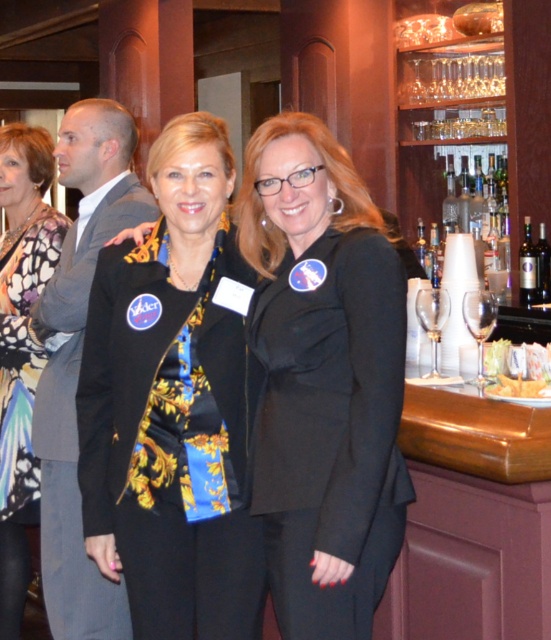
Which is behind, point (40, 419) or point (15, 272)?

The point (15, 272) is more distant.

Does point (56, 538) come behind point (17, 390)?

No.

Does point (45, 451) lie in front of point (34, 374)?

Yes, point (45, 451) is closer to viewer.

In order to click on gray suit at left in this screenshot , I will do coord(79,362).

Is black matte blazer at center below gray suit at left?

Indeed, black matte blazer at center is positioned under gray suit at left.

The width and height of the screenshot is (551, 640). Identify the location of black matte blazer at center. (329, 428).

How far apart are black satin blazer at center and gray suit at left?

black satin blazer at center and gray suit at left are 21.09 inches apart.

Is point (117, 403) positioned in front of point (62, 461)?

Yes, point (117, 403) is in front of point (62, 461).

Which is behind, point (191, 484) or point (53, 497)?

The point (53, 497) is more distant.

I want to click on black satin blazer at center, so click(170, 440).